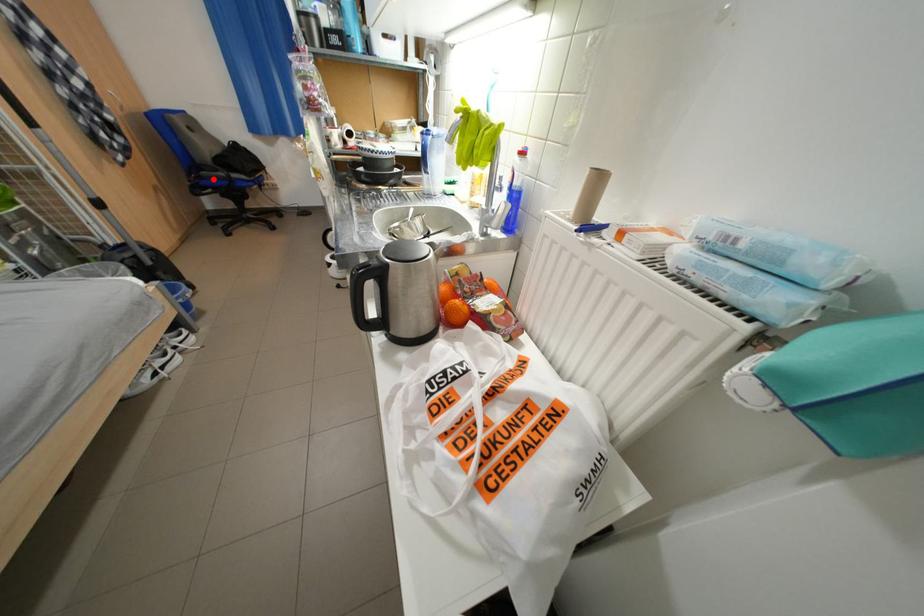
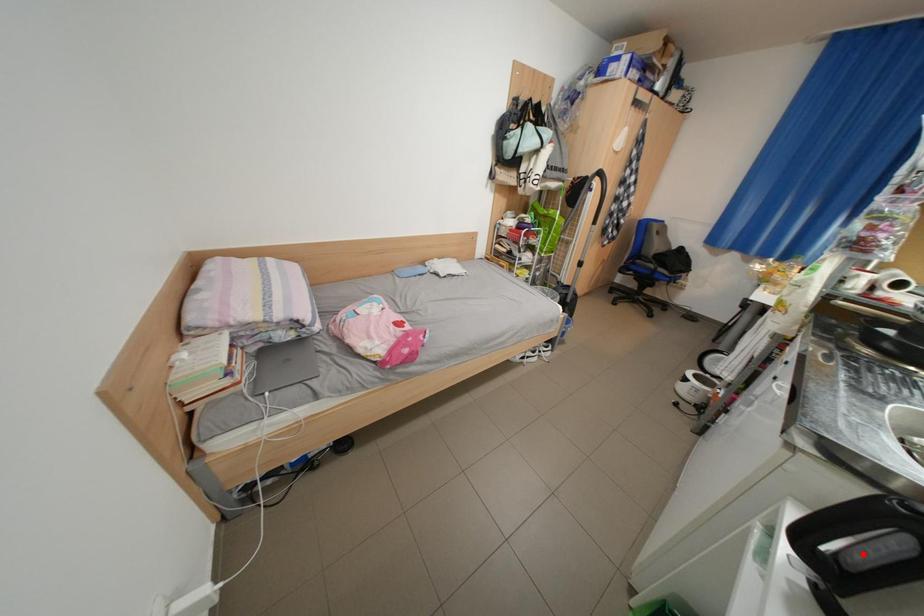
I am providing you with two images of the same scene from different viewpoints. A red point is marked on the first image and another point is marked on the second image. Does the point marked in image1 correspond to the same location as the one in image2?

No